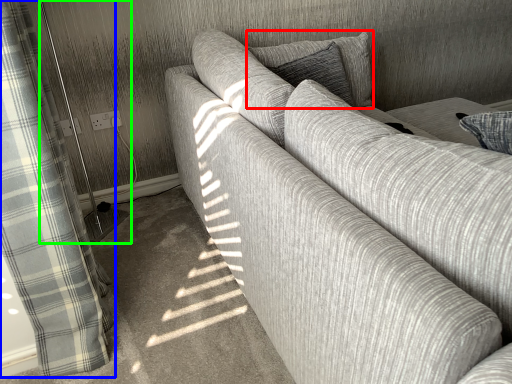
Question: Estimate the real-world distances between objects in this image. Which object is closer to pillow (highlighted by a red box), curtain (highlighted by a blue box) or screen door (highlighted by a green box)?

Choices:
 (A) curtain
 (B) screen door

Answer: (A)